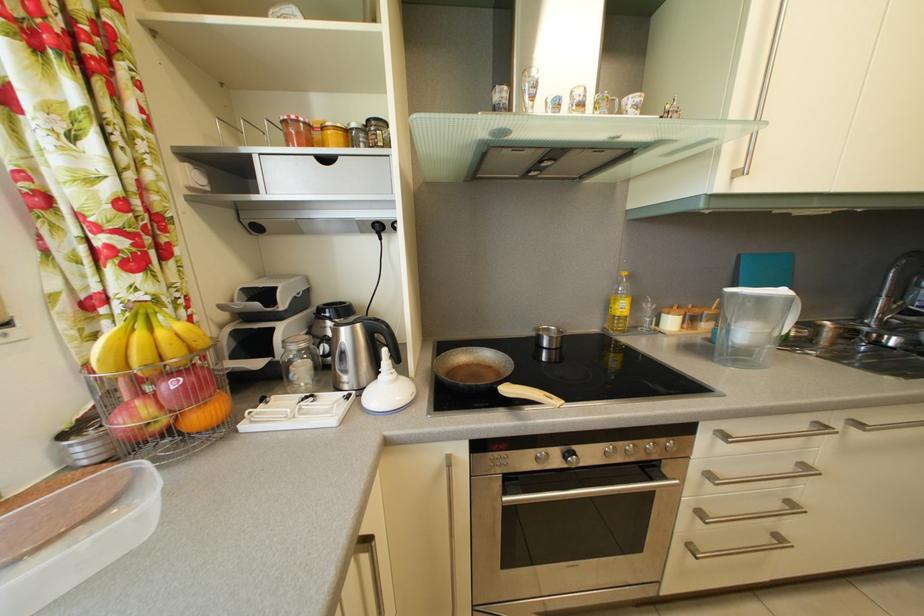
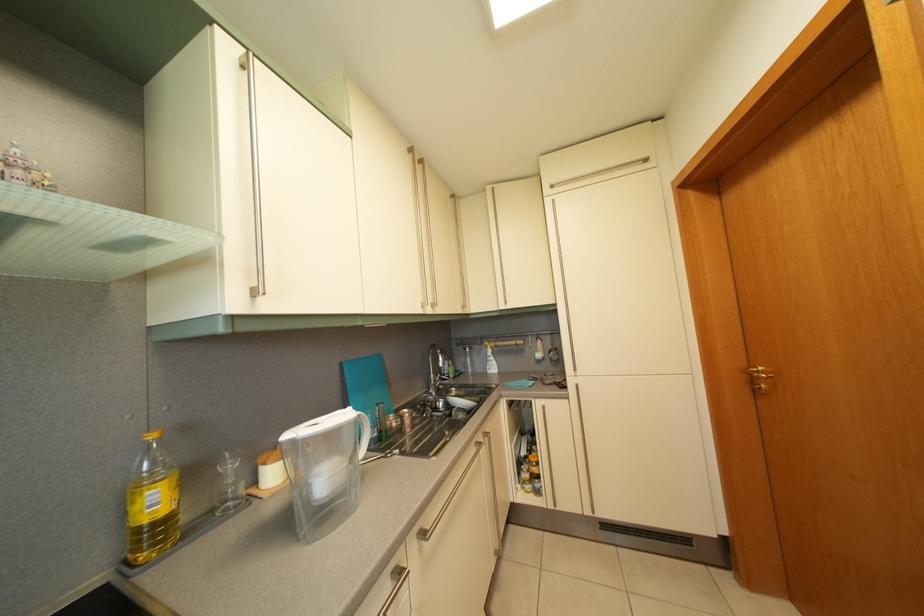
Question: The camera is either moving clockwise (left) or counter-clockwise (right) around the object. The first image is from the beginning of the video and the second image is from the end. Is the camera moving left or right when shooting the video?

Choices:
 (A) Left
 (B) Right

Answer: (A)